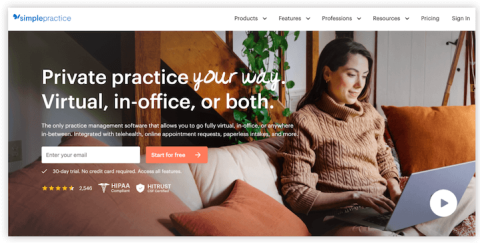
The width and height of the screenshot is (480, 243). I want to click on off-white colored wall with vertical lines, so click(x=392, y=61).